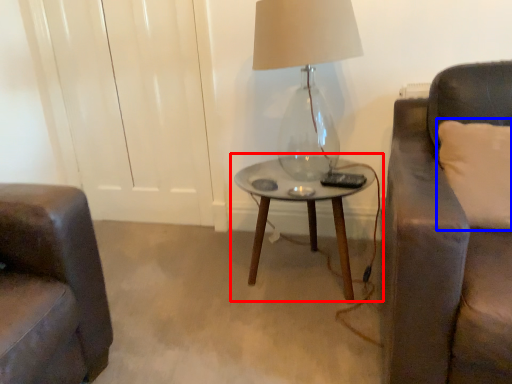
Question: Which object is closer to the camera taking this photo, table (highlighted by a red box) or pillow (highlighted by a blue box)?

Choices:
 (A) table
 (B) pillow

Answer: (B)